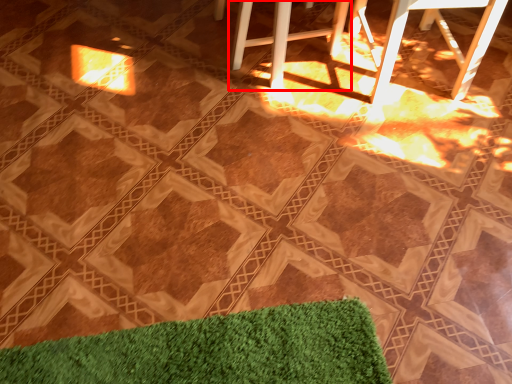
Question: Considering the relative positions of bar stool (annotated by the red box) and bar stool in the image provided, where is bar stool (annotated by the red box) located with respect to the staircase?

Choices:
 (A) right
 (B) left

Answer: (B)